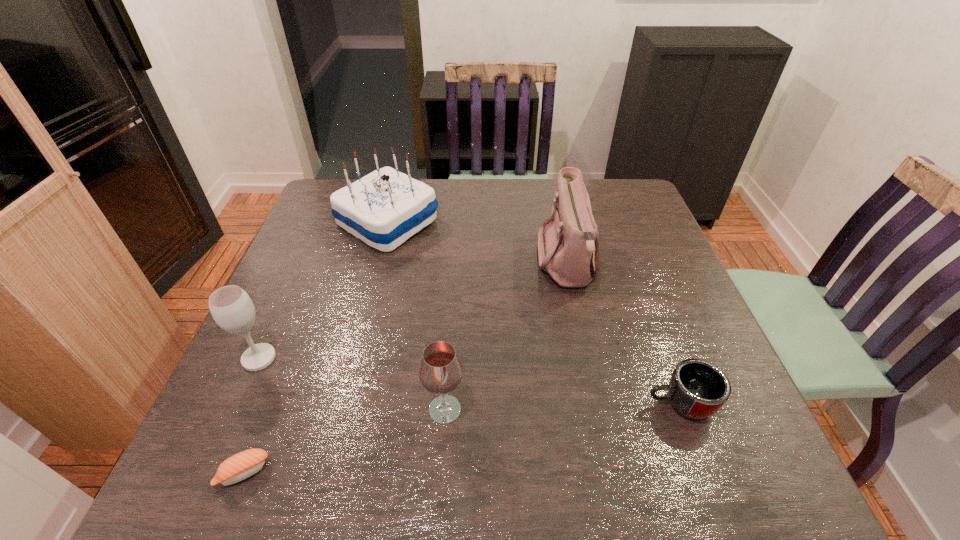
Find the location of a particular element. The height and width of the screenshot is (540, 960). unoccupied position between the birthday cake and the fourth object from left to right is located at coordinates (416, 316).

The image size is (960, 540). I want to click on vacant area between the birthday cake and the second object from right to left, so click(x=477, y=242).

Where is `free space between the right wineglass and the birthday cake`? This screenshot has height=540, width=960. free space between the right wineglass and the birthday cake is located at coordinates (416, 316).

In order to click on the fifth closest object to the fifth object from left to right in this screenshot , I will do `click(240, 466)`.

Identify which object is the second nearest to the shoulder bag. Please provide its 2D coordinates. Your answer should be formatted as a tuple, i.e. [(x, y)], where the tuple contains the x and y coordinates of a point satisfying the conditions above.

[(386, 207)]

Image resolution: width=960 pixels, height=540 pixels. Identify the location of vacant region that satisfies the following two spatial constraints: 1. on the back side of the nearest object; 2. on the left side of the birthday cake. (341, 222).

Locate an element on the screen. The width and height of the screenshot is (960, 540). free spot that satisfies the following two spatial constraints: 1. on the side of the rightmost object with the handle; 2. on the front side of the nearest object is located at coordinates (706, 472).

Where is `free space that satisfies the following two spatial constraints: 1. on the front side of the right wineglass; 2. on the right side of the farther wineglass`? The image size is (960, 540). free space that satisfies the following two spatial constraints: 1. on the front side of the right wineglass; 2. on the right side of the farther wineglass is located at coordinates (236, 409).